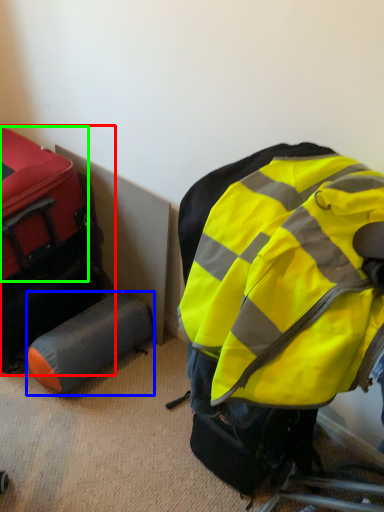
Question: Based on their relative distances, which object is farther from luggage and bags (highlighted by a red box)? Choose from luggage (highlighted by a blue box) and luggage (highlighted by a green box).

Choices:
 (A) luggage
 (B) luggage

Answer: (A)